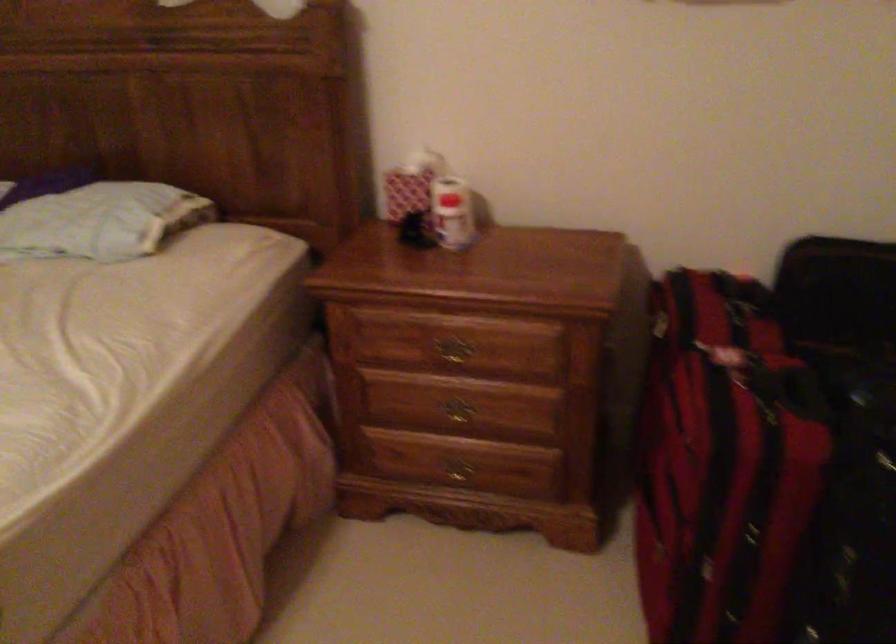
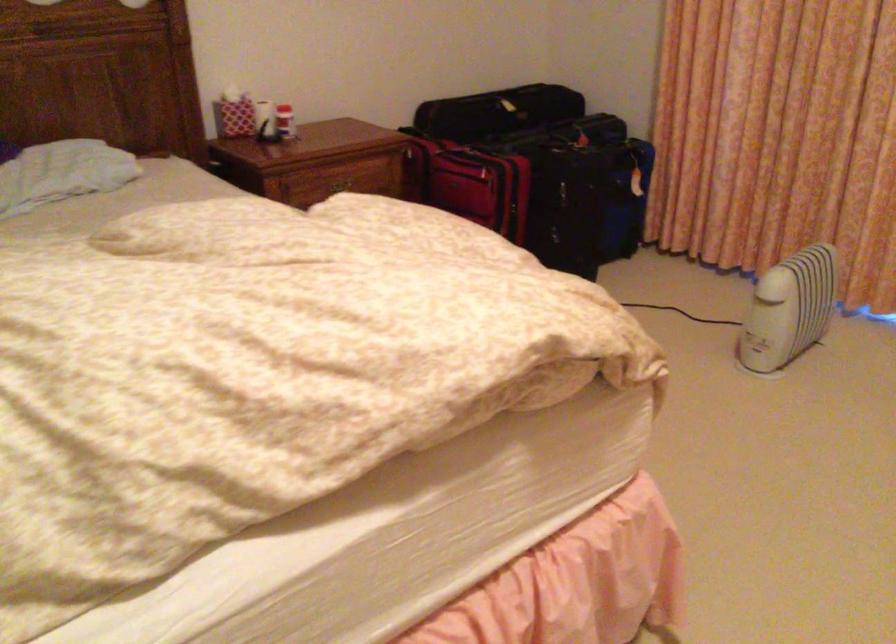
Question: I am providing you with two images of the same scene from different viewpoints. Which of the following objects are not visible in image2?

Choices:
 (A) blue suitcase
 (B) black canister
 (C) black suitcase handle
 (D) brass drawer handle

Answer: (D)